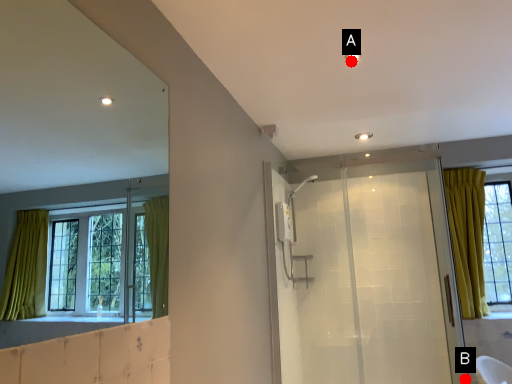
Question: Two points are circled on the image, labeled by A and B beside each circle. Which point is farther from the camera taking this photo?

Choices:
 (A) A is further
 (B) B is further

Answer: (B)